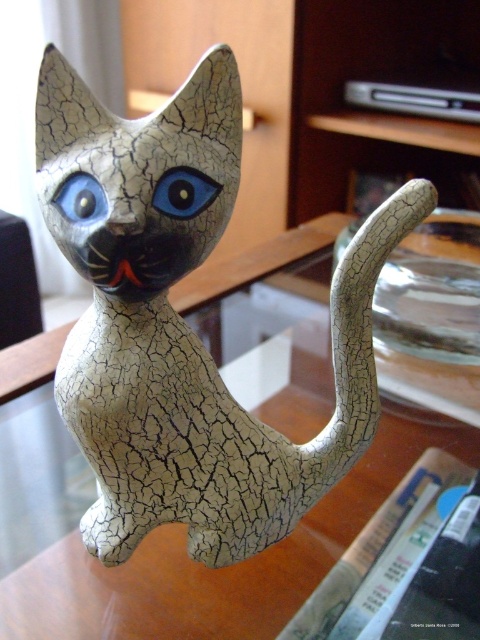
Question: Does cracked ceramic cat at center have a lesser width compared to blue glossy eye at left?

Choices:
 (A) yes
 (B) no

Answer: (B)

Question: Which of the following is the closest to the observer?

Choices:
 (A) (113, 300)
 (B) (176, 193)
 (C) (93, 184)

Answer: (C)

Question: Which is nearer to the blue glossy eye at center?

Choices:
 (A) blue glossy eye at left
 (B) cracked ceramic cat at center

Answer: (A)

Question: Does cracked ceramic cat at center come behind blue glossy eye at center?

Choices:
 (A) yes
 (B) no

Answer: (B)

Question: Can you confirm if blue glossy eye at center is wider than blue glossy eye at left?

Choices:
 (A) no
 (B) yes

Answer: (B)

Question: Which of the following is the closest to the observer?

Choices:
 (A) blue glossy eye at left
 (B) cracked ceramic cat at center
 (C) blue glossy eye at center

Answer: (B)